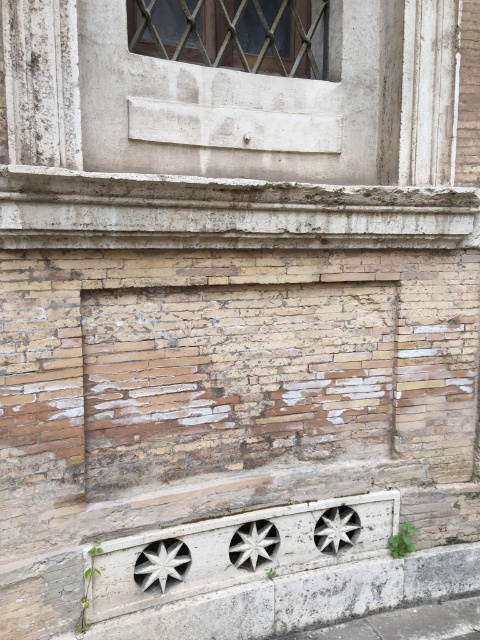
Question: Which point is farther to the camera?

Choices:
 (A) metallic gridwork window at upper center
 (B) white concrete curb at lower center
 (C) gray concrete pavement at lower center

Answer: (C)

Question: Does metallic gridwork window at upper center appear on the right side of gray concrete pavement at lower center?

Choices:
 (A) yes
 (B) no

Answer: (B)

Question: Can you confirm if metallic gridwork window at upper center is positioned to the left of gray concrete pavement at lower center?

Choices:
 (A) no
 (B) yes

Answer: (B)

Question: Which point appears closest to the camera in this image?

Choices:
 (A) (465, 628)
 (B) (386, 579)
 (C) (172, 17)

Answer: (A)

Question: Which point is farther to the camera?

Choices:
 (A) metallic gridwork window at upper center
 (B) white concrete curb at lower center

Answer: (A)

Question: Is white concrete curb at lower center wider than metallic gridwork window at upper center?

Choices:
 (A) no
 (B) yes

Answer: (B)